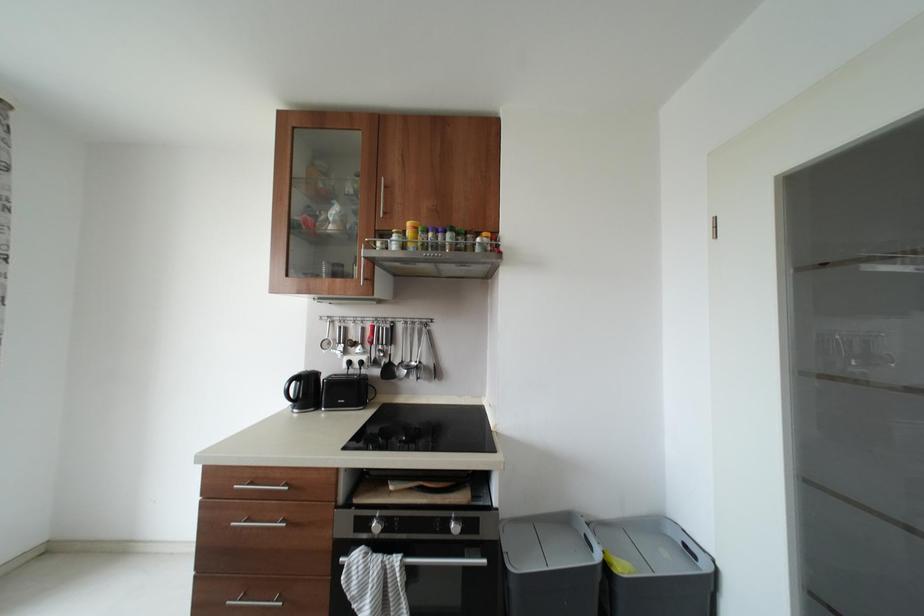
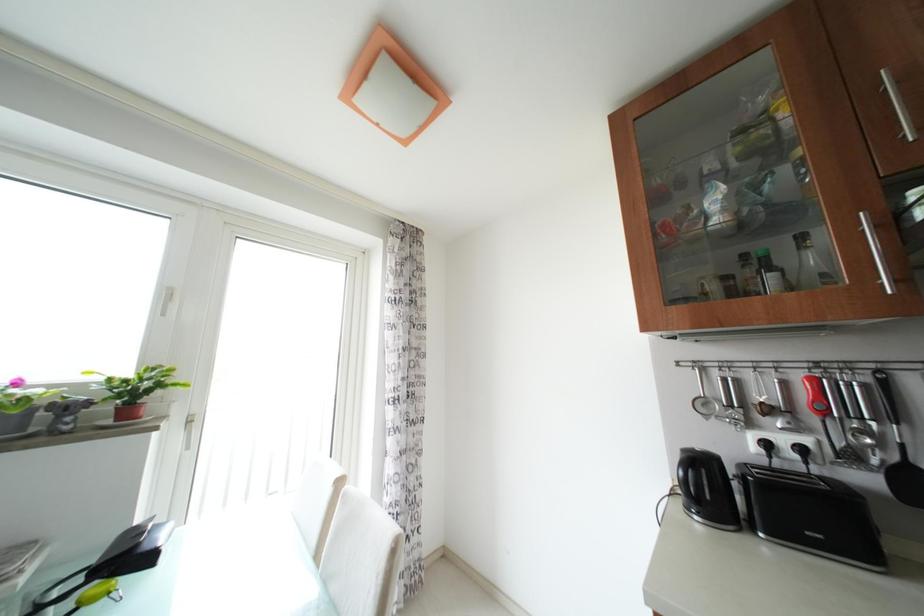
Question: The first image is from the beginning of the video and the second image is from the end. How did the camera likely rotate when shooting the video?

Choices:
 (A) Left
 (B) Right
 (C) Up
 (D) Down

Answer: (A)